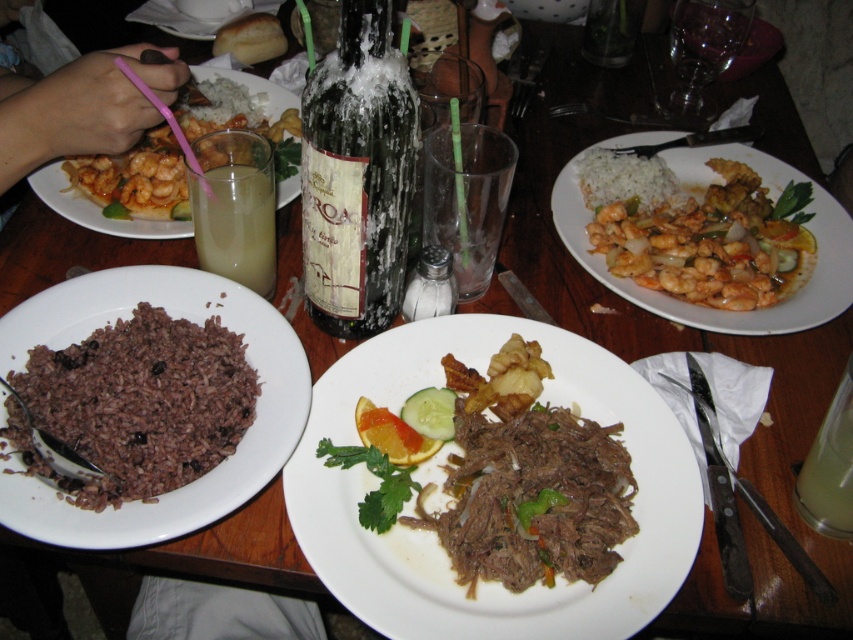
You are a food critic observing the dining scene. You notice the shiny orange shrimp at upper left and the yellow translucent liquid at center. Which object is higher in height?

The shiny orange shrimp at upper left is taller than the yellow translucent liquid at center.

What is located at the coordinates point (437, 536) in the image?

The point (437, 536) marks the shredded meat at center.

Consider the image. You are a waiter trying to place a new dish on the table. There are two points marked on the table where you can place it. The first point is at coordinate point(310, 538) and the second is at point(489, 436). Which point is closer to you so that you can easily reach it?

Point(310, 538) is closer to the viewer than point(489, 436), so you should choose point(310, 538) to place the new dish as it is easier to reach.